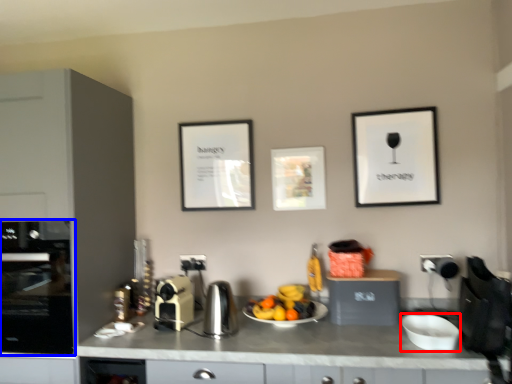
Question: Which point is further to the camera, bowl (highlighted by a red box) or home appliance (highlighted by a blue box)?

Choices:
 (A) bowl
 (B) home appliance

Answer: (B)